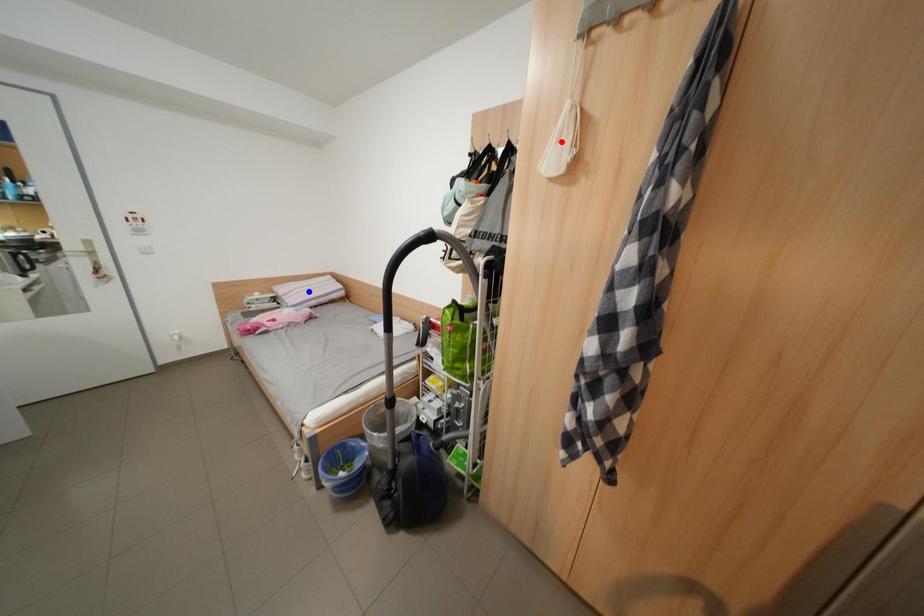
Question: In the image, two points are highlighted. Which point is nearer to the camera? Reply with the corresponding letter.

Choices:
 (A) blue point
 (B) red point

Answer: (B)